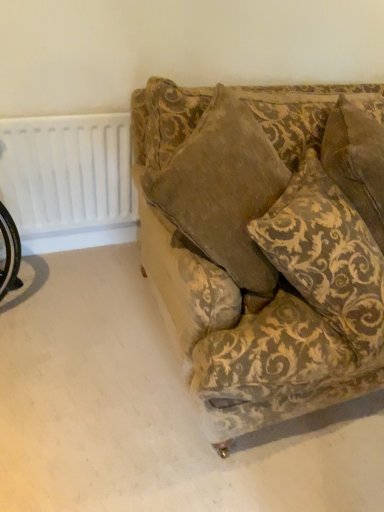
In order to click on velvet-patterned couch at center in this screenshot , I will do `click(263, 245)`.

What are the coordinates of `gold-patterned fabric pillow at upper right` in the screenshot? It's located at (327, 255).

Is white plastic radiator at upper left beside gold-patterned fabric pillow at upper right?

No, white plastic radiator at upper left is not making contact with gold-patterned fabric pillow at upper right.

Considering the sizes of white plastic radiator at upper left and gold-patterned fabric pillow at upper right in the image, is white plastic radiator at upper left taller or shorter than gold-patterned fabric pillow at upper right?

In the image, white plastic radiator at upper left appears to be shorter than gold-patterned fabric pillow at upper right.

Would you say gold-patterned fabric pillow at upper right is part of white plastic radiator at upper left's contents?

No, gold-patterned fabric pillow at upper right is not surrounded by white plastic radiator at upper left.

Is velvet-patterned couch at center in front of or behind white plastic radiator at upper left in the image?

In the image, velvet-patterned couch at center appears in front of white plastic radiator at upper left.

Who is bigger, velvet-patterned couch at center or white plastic radiator at upper left?

Bigger between the two is velvet-patterned couch at center.

You are a GUI agent. You are given a task and a screenshot of the screen. Output one action in this format:
    pyautogui.click(x=<x>, y=<y>)
    Task: Click on the studio couch above the white plastic radiator at upper left (from a real-world perspective)
    
    Given the screenshot: What is the action you would take?
    (263, 245)

Can you confirm if white plastic radiator at upper left is positioned to the left of velvet-patterned couch at center?

Correct, you'll find white plastic radiator at upper left to the left of velvet-patterned couch at center.

From a real-world perspective, who is located lower, white plastic radiator at upper left or velvet-patterned couch at center?

white plastic radiator at upper left is physically lower.

Is white plastic radiator at upper left positioned behind velvet-patterned couch at center?

Yes, white plastic radiator at upper left is further from the camera.

Between white plastic radiator at upper left and velvet-patterned couch at center, which one has larger width?

Wider between the two is velvet-patterned couch at center.

Is gold-patterned fabric pillow at upper right wider or thinner than velvet-patterned couch at center?

In the image, gold-patterned fabric pillow at upper right appears to be more narrow than velvet-patterned couch at center.

How many degrees apart are the facing directions of gold-patterned fabric pillow at upper right and velvet-patterned couch at center?

The angle between the facing direction of gold-patterned fabric pillow at upper right and the facing direction of velvet-patterned couch at center is 13.8 degrees.

Does gold-patterned fabric pillow at upper right have a larger size compared to velvet-patterned couch at center?

Correct, gold-patterned fabric pillow at upper right is larger in size than velvet-patterned couch at center.

Considering the relative positions of gold-patterned fabric pillow at upper right and velvet-patterned couch at center in the image provided, is gold-patterned fabric pillow at upper right to the left or to the right of velvet-patterned couch at center?

gold-patterned fabric pillow at upper right is positioned on velvet-patterned couch at center's right side.

In the scene shown: Can you tell me how much gold-patterned fabric pillow at upper right and white plastic radiator at upper left differ in facing direction?

The angle between the facing direction of gold-patterned fabric pillow at upper right and the facing direction of white plastic radiator at upper left is 55.4 degrees.

From a real-world perspective, which object stands above the other?

gold-patterned fabric pillow at upper right is physically above.

From the image's perspective, is gold-patterned fabric pillow at upper right below white plastic radiator at upper left?

Yes, from the image's perspective, gold-patterned fabric pillow at upper right is beneath white plastic radiator at upper left.

Is gold-patterned fabric pillow at upper right directly adjacent to white plastic radiator at upper left?

gold-patterned fabric pillow at upper right is not next to white plastic radiator at upper left, and they're not touching.

Who is bigger, velvet-patterned couch at center or gold-patterned fabric pillow at upper right?

gold-patterned fabric pillow at upper right is bigger.

How many degrees apart are the facing directions of velvet-patterned couch at center and gold-patterned fabric pillow at upper right?

They differ by 13.8 degrees in their facing directions.

From the image's perspective, is velvet-patterned couch at center located above gold-patterned fabric pillow at upper right?

No.

The height and width of the screenshot is (512, 384). Identify the location of throw pillow in front of the white plastic radiator at upper left. (327, 255).

Identify the location of studio couch located on the right of white plastic radiator at upper left. (263, 245).

Considering their positions, is white plastic radiator at upper left positioned further to gold-patterned fabric pillow at upper right than velvet-patterned couch at center?

The object further to gold-patterned fabric pillow at upper right is white plastic radiator at upper left.

Looking at the image, which one is located closer to gold-patterned fabric pillow at upper right, velvet-patterned couch at center or white plastic radiator at upper left?

Based on the image, velvet-patterned couch at center appears to be nearer to gold-patterned fabric pillow at upper right.

From the image, which object appears to be nearer to velvet-patterned couch at center, gold-patterned fabric pillow at upper right or white plastic radiator at upper left?

gold-patterned fabric pillow at upper right is closer to velvet-patterned couch at center.

From the image, which object appears to be farther from white plastic radiator at upper left, gold-patterned fabric pillow at upper right or velvet-patterned couch at center?

gold-patterned fabric pillow at upper right is positioned further to the anchor white plastic radiator at upper left.

From the image, which object appears to be farther from velvet-patterned couch at center, white plastic radiator at upper left or gold-patterned fabric pillow at upper right?

white plastic radiator at upper left.

From the image, which object appears to be farther from white plastic radiator at upper left, velvet-patterned couch at center or gold-patterned fabric pillow at upper right?

gold-patterned fabric pillow at upper right is positioned further to the anchor white plastic radiator at upper left.

At what (x,y) coordinates should I click in order to perform the action: click on studio couch located between white plastic radiator at upper left and gold-patterned fabric pillow at upper right in the left-right direction. Please return your answer as a coordinate pair (x, y). Looking at the image, I should click on (263, 245).